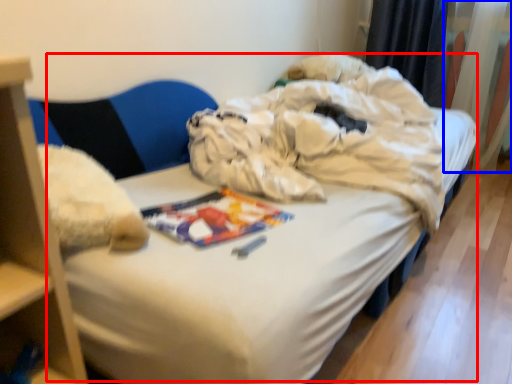
Question: Which object appears closest to the camera in this image, bed (highlighted by a red box) or curtain (highlighted by a blue box)?

Choices:
 (A) bed
 (B) curtain

Answer: (A)